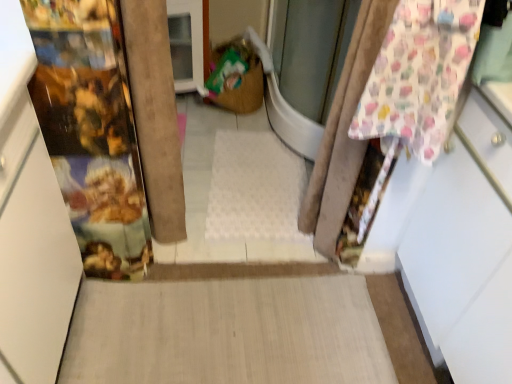
What do you see at coordinates (388, 109) in the screenshot? I see `floral fabric curtain at right` at bounding box center [388, 109].

Where is `floral fabric curtain at right`? floral fabric curtain at right is located at coordinates click(388, 109).

Where is `floral fabric curtain at right`? Image resolution: width=512 pixels, height=384 pixels. floral fabric curtain at right is located at coordinates (388, 109).